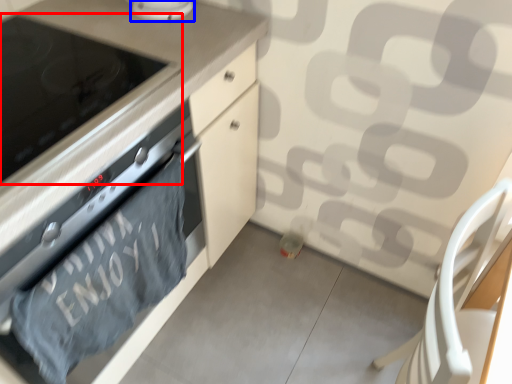
Question: Which object is further to the camera taking this photo, home appliance (highlighted by a red box) or kitchen appliance (highlighted by a blue box)?

Choices:
 (A) home appliance
 (B) kitchen appliance

Answer: (B)